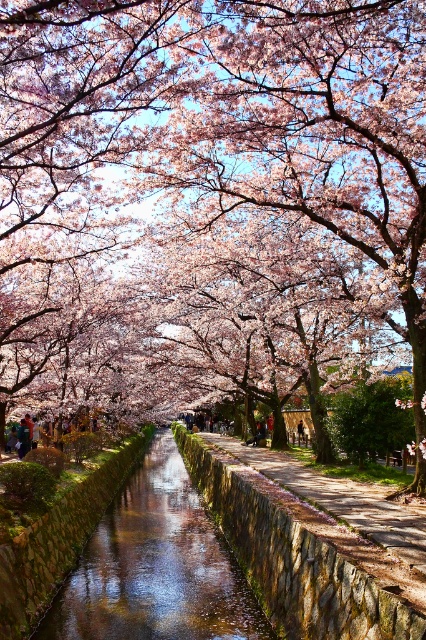
You are standing on the stone wall next to the canal and see the clear water at center and the dark blue fabric person at center. If you want to throw a small pebble into the water without hitting the person, which direction should you aim? Please explain your reasoning based on their widths.

The clear water at center is wider than the dark blue fabric person at center. To avoid hitting the person, aim towards the wider area of the clear water at center since it spans a greater width than the dark blue fabric person at center.

You are a tourist visiting the cherry blossom canal. You want to walk from the clear water at center to the stone paved path at center. Can you walk directly between them without stepping on anything else? Explain why or why not based on the distance between them.

The clear water at center and stone paved path at center are 9.37 meters apart. Since the distance is quite large, you cannot walk directly between them without stepping on anything else as there might be a gap or other obstacles between them.

You are standing on the stone paved path at center and want to reach the clear water at center. Which direction should you move to get to the water?

You should move to your left to reach the clear water at center, as it is located to the left of the stone paved path at center.